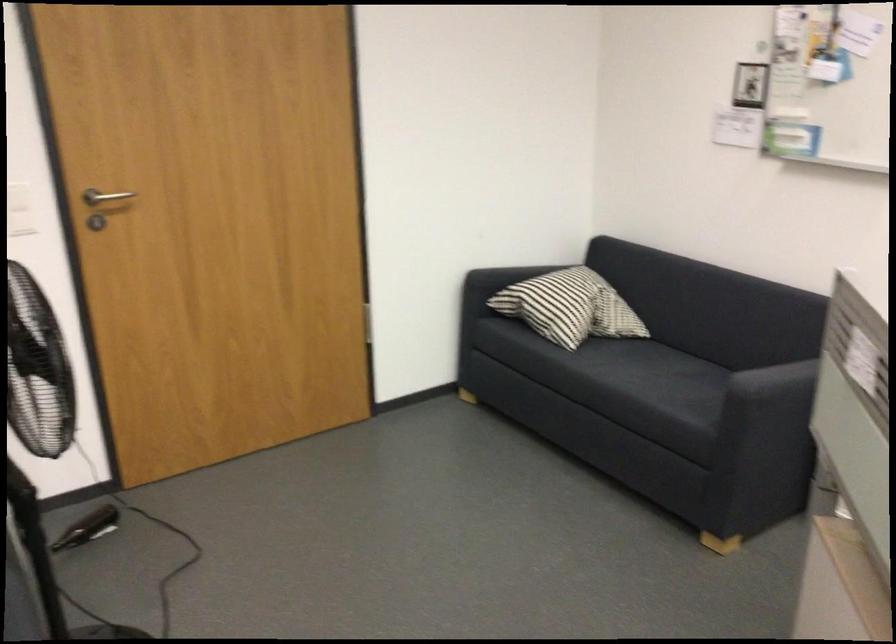
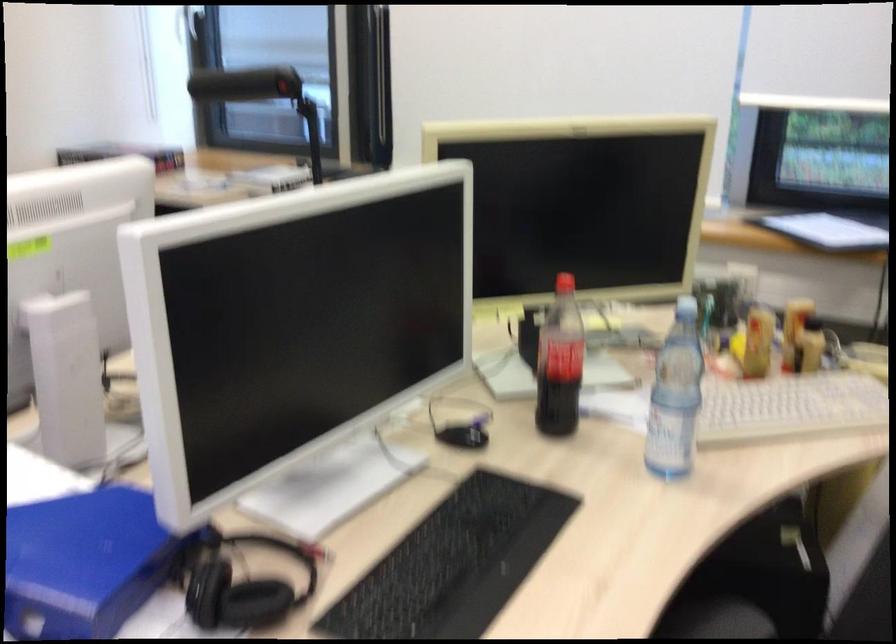
First-person continuous shooting, in which direction is the camera rotating?

The camera's rotation is toward right-down.